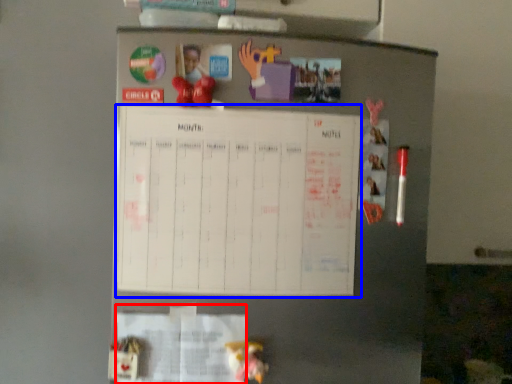
Question: Which object appears farthest to the camera in this image, paper (highlighted by a red box) or bulletin board (highlighted by a blue box)?

Choices:
 (A) paper
 (B) bulletin board

Answer: (A)